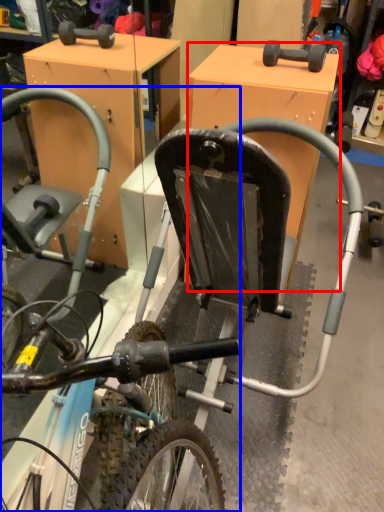
Question: Among these objects, which one is nearest to the camera, table (highlighted by a red box) or bicycle (highlighted by a blue box)?

Choices:
 (A) table
 (B) bicycle

Answer: (B)